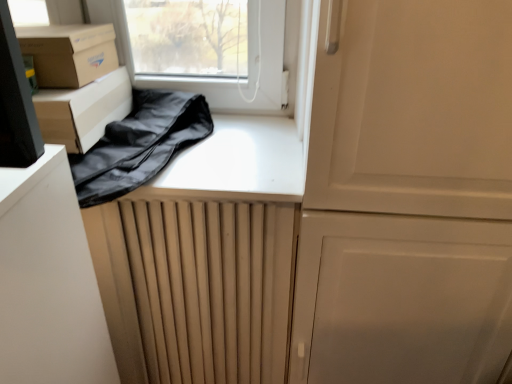
Find the location of a particular element. matte cardboard box at left, which is counted as the 1th cardboard box, starting from the bottom is located at coordinates (83, 110).

Considering the relative sizes of black fabric bag at upper left and brown cardboard box at upper left, the 2th cardboard box from the bottom, in the image provided, is black fabric bag at upper left bigger than brown cardboard box at upper left, the 2th cardboard box from the bottom,?

Correct, black fabric bag at upper left is larger in size than brown cardboard box at upper left, the 2th cardboard box from the bottom.

Between black fabric bag at upper left and brown cardboard box at upper left, the first cardboard box in the top-to-bottom sequence, which one has less height?

With less height is black fabric bag at upper left.

This screenshot has height=384, width=512. Find the location of `clothing that appears below the brown cardboard box at upper left, the first cardboard box in the top-to-bottom sequence (from the image's perspective)`. clothing that appears below the brown cardboard box at upper left, the first cardboard box in the top-to-bottom sequence (from the image's perspective) is located at coordinates (140, 144).

Which is behind, point (166, 154) or point (110, 41)?

The point (110, 41) is behind.

In the image, is brown cardboard box at upper left, the 2th cardboard box from the bottom, on the left side or the right side of matte cardboard box at left, which is counted as the 1th cardboard box, starting from the bottom?

Clearly, brown cardboard box at upper left, the 2th cardboard box from the bottom, is on the right of matte cardboard box at left, which is counted as the 1th cardboard box, starting from the bottom, in the image.

Consider the image. Is brown cardboard box at upper left, the first cardboard box in the top-to-bottom sequence, not inside matte cardboard box at left, which is counted as the 1th cardboard box, starting from the bottom?

Indeed, brown cardboard box at upper left, the first cardboard box in the top-to-bottom sequence, is completely outside matte cardboard box at left, which is counted as the 1th cardboard box, starting from the bottom.

Between brown cardboard box at upper left, the 2th cardboard box from the bottom, and matte cardboard box at left, which is counted as the 1th cardboard box, starting from the bottom, which one has smaller width?

Thinner between the two is brown cardboard box at upper left, the 2th cardboard box from the bottom.

In the scene shown: From a real-world perspective, is brown cardboard box at upper left, the first cardboard box in the top-to-bottom sequence, above or below matte cardboard box at left, which is counted as the 1th cardboard box, starting from the bottom?

Clearly, from a real-world perspective, brown cardboard box at upper left, the first cardboard box in the top-to-bottom sequence, is above matte cardboard box at left, which is counted as the 1th cardboard box, starting from the bottom.

Which object is thinner, black fabric bag at upper left or matte cardboard box at left, which is counted as the 1th cardboard box, starting from the bottom?

matte cardboard box at left, which is counted as the 1th cardboard box, starting from the bottom.

Is black fabric bag at upper left to the right of matte cardboard box at left, which is counted as the 1th cardboard box, starting from the bottom, from the viewer's perspective?

Yes, black fabric bag at upper left is to the right of matte cardboard box at left, which is counted as the 1th cardboard box, starting from the bottom.

Can you tell me how much black fabric bag at upper left and matte cardboard box at left, the 2th cardboard box when ordered from top to bottom, differ in facing direction?

There is a 3.76-degree angle between the facing directions of black fabric bag at upper left and matte cardboard box at left, the 2th cardboard box when ordered from top to bottom.

Between matte cardboard box at left, which is counted as the 1th cardboard box, starting from the bottom, and brown cardboard box at upper left, the 2th cardboard box from the bottom, which one has larger width?

matte cardboard box at left, which is counted as the 1th cardboard box, starting from the bottom.

Considering the positions of objects matte cardboard box at left, the 2th cardboard box when ordered from top to bottom, and brown cardboard box at upper left, the first cardboard box in the top-to-bottom sequence, in the image provided, who is more to the right, matte cardboard box at left, the 2th cardboard box when ordered from top to bottom, or brown cardboard box at upper left, the first cardboard box in the top-to-bottom sequence,?

brown cardboard box at upper left, the first cardboard box in the top-to-bottom sequence, is more to the right.

From the image's perspective, who appears lower, matte cardboard box at left, the 2th cardboard box when ordered from top to bottom, or brown cardboard box at upper left, the first cardboard box in the top-to-bottom sequence?

matte cardboard box at left, the 2th cardboard box when ordered from top to bottom, appears lower in the image.

Could you tell me if matte cardboard box at left, the 2th cardboard box when ordered from top to bottom, is turned towards brown cardboard box at upper left, the first cardboard box in the top-to-bottom sequence?

No, matte cardboard box at left, the 2th cardboard box when ordered from top to bottom, is not aimed at brown cardboard box at upper left, the first cardboard box in the top-to-bottom sequence.

From a real-world perspective, is brown cardboard box at upper left, the 2th cardboard box from the bottom, physically located above or below black fabric bag at upper left?

In terms of real-world spatial position, brown cardboard box at upper left, the 2th cardboard box from the bottom, is above black fabric bag at upper left.

Is point (94, 69) farther from camera compared to point (149, 97)?

No.

Based on the photo, from the image's perspective, is brown cardboard box at upper left, the first cardboard box in the top-to-bottom sequence, on top of black fabric bag at upper left?

Yes.

Is brown cardboard box at upper left, the first cardboard box in the top-to-bottom sequence, positioned with its back to black fabric bag at upper left?

brown cardboard box at upper left, the first cardboard box in the top-to-bottom sequence, is not turned away from black fabric bag at upper left.

Considering the relative positions of matte cardboard box at left, which is counted as the 1th cardboard box, starting from the bottom, and black fabric bag at upper left in the image provided, is matte cardboard box at left, which is counted as the 1th cardboard box, starting from the bottom, in front of black fabric bag at upper left?

No, it is not.

Could you measure the distance between matte cardboard box at left, the 2th cardboard box when ordered from top to bottom, and black fabric bag at upper left?

matte cardboard box at left, the 2th cardboard box when ordered from top to bottom, and black fabric bag at upper left are 3.96 inches apart.

In the scene shown: From the image's perspective, is matte cardboard box at left, the 2th cardboard box when ordered from top to bottom, positioned above or below black fabric bag at upper left?

matte cardboard box at left, the 2th cardboard box when ordered from top to bottom, is above black fabric bag at upper left.

How different are the orientations of matte cardboard box at left, the 2th cardboard box when ordered from top to bottom, and black fabric bag at upper left in degrees?

There is a 3.76-degree angle between the facing directions of matte cardboard box at left, the 2th cardboard box when ordered from top to bottom, and black fabric bag at upper left.

This screenshot has height=384, width=512. I want to click on clothing below the brown cardboard box at upper left, the first cardboard box in the top-to-bottom sequence (from a real-world perspective), so click(140, 144).

Identify the location of cardboard box behind the matte cardboard box at left, the 2th cardboard box when ordered from top to bottom. (69, 53).

Estimate the real-world distances between objects in this image. Which object is closer to brown cardboard box at upper left, the 2th cardboard box from the bottom, black fabric bag at upper left or matte cardboard box at left, which is counted as the 1th cardboard box, starting from the bottom?

matte cardboard box at left, which is counted as the 1th cardboard box, starting from the bottom, is positioned closer to the anchor brown cardboard box at upper left, the 2th cardboard box from the bottom.

Looking at the image, which one is located closer to black fabric bag at upper left, matte cardboard box at left, which is counted as the 1th cardboard box, starting from the bottom, or brown cardboard box at upper left, the first cardboard box in the top-to-bottom sequence?

Based on the image, matte cardboard box at left, which is counted as the 1th cardboard box, starting from the bottom, appears to be nearer to black fabric bag at upper left.

From the image, which object appears to be farther from brown cardboard box at upper left, the first cardboard box in the top-to-bottom sequence, matte cardboard box at left, which is counted as the 1th cardboard box, starting from the bottom, or black fabric bag at upper left?

black fabric bag at upper left.

Estimate the real-world distances between objects in this image. Which object is further from black fabric bag at upper left, brown cardboard box at upper left, the first cardboard box in the top-to-bottom sequence, or matte cardboard box at left, which is counted as the 1th cardboard box, starting from the bottom?

brown cardboard box at upper left, the first cardboard box in the top-to-bottom sequence, lies further to black fabric bag at upper left than the other object.

Based on their spatial positions, is black fabric bag at upper left or brown cardboard box at upper left, the 2th cardboard box from the bottom, closer to matte cardboard box at left, which is counted as the 1th cardboard box, starting from the bottom?

brown cardboard box at upper left, the 2th cardboard box from the bottom, is closer to matte cardboard box at left, which is counted as the 1th cardboard box, starting from the bottom.

Considering their positions, is brown cardboard box at upper left, the 2th cardboard box from the bottom, positioned closer to matte cardboard box at left, which is counted as the 1th cardboard box, starting from the bottom, than black fabric bag at upper left?

Among the two, brown cardboard box at upper left, the 2th cardboard box from the bottom, is located nearer to matte cardboard box at left, which is counted as the 1th cardboard box, starting from the bottom.

Image resolution: width=512 pixels, height=384 pixels. Find the location of `cardboard box between brown cardboard box at upper left, the 2th cardboard box from the bottom, and black fabric bag at upper left from top to bottom`. cardboard box between brown cardboard box at upper left, the 2th cardboard box from the bottom, and black fabric bag at upper left from top to bottom is located at coordinates (83, 110).